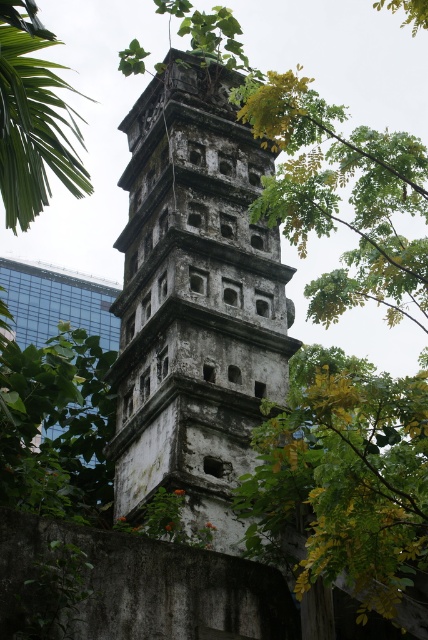
You are standing at the center of the image. Which direction should you move to get closer to the weathered stone tower at center?

Since the weathered stone tower at center is already at the center of the image, you are already facing it. There is no need to move in any direction to get closer.

You are standing in front of the historical monument and want to determine the relative positions of two points marked on the structure. Which of the two points, point (x=157, y=470) or point (x=65, y=163), is closer to you?

Point (x=157, y=470) is closer to you because it is further to the viewer than point (x=65, y=163).